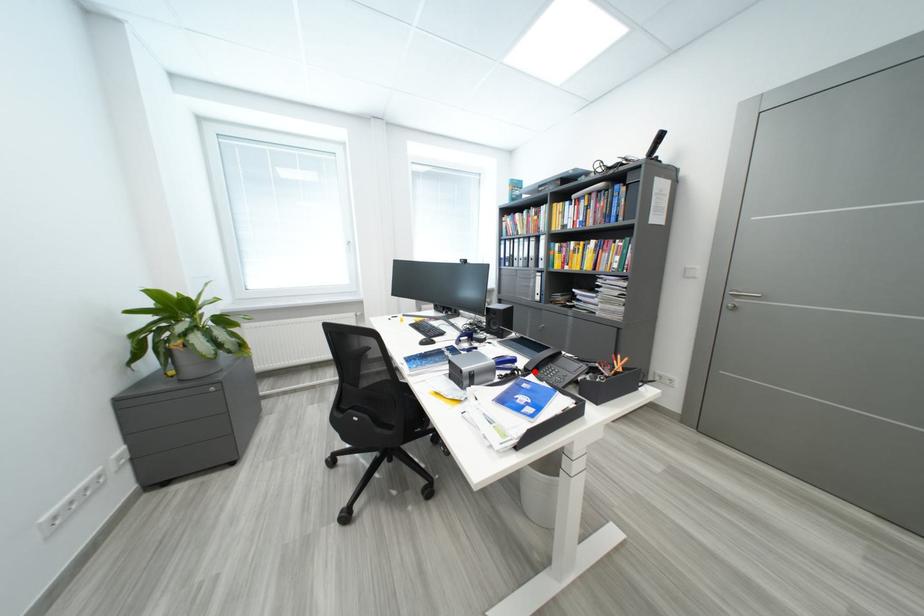
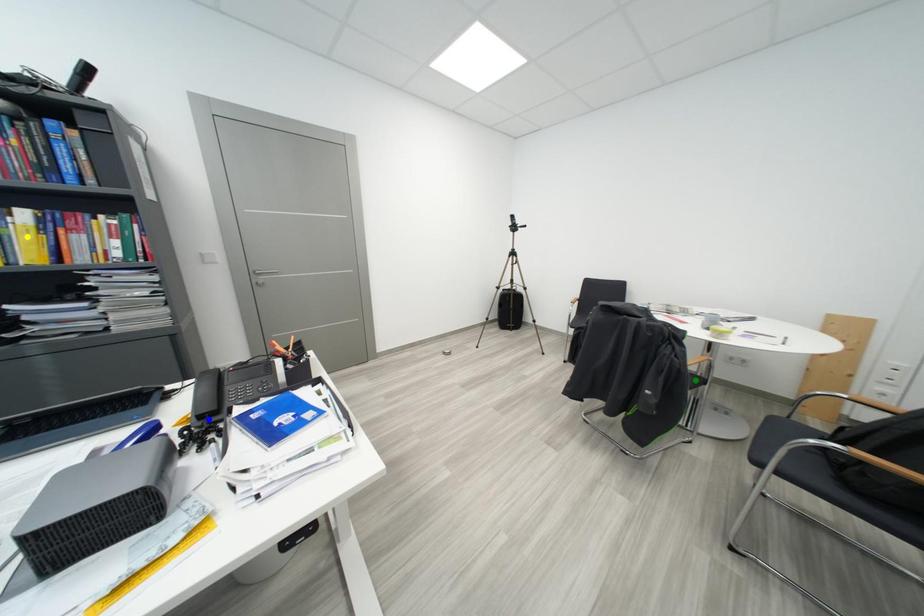
Question: I am providing you with two images of the same scene from different viewpoints. A red point is marked on the first image. You are given multiple points on the second image. In image 2, which mark is for the same physical point as the one in image 1?

Choices:
 (A) blue point
 (B) green point
 (C) yellow point

Answer: (A)